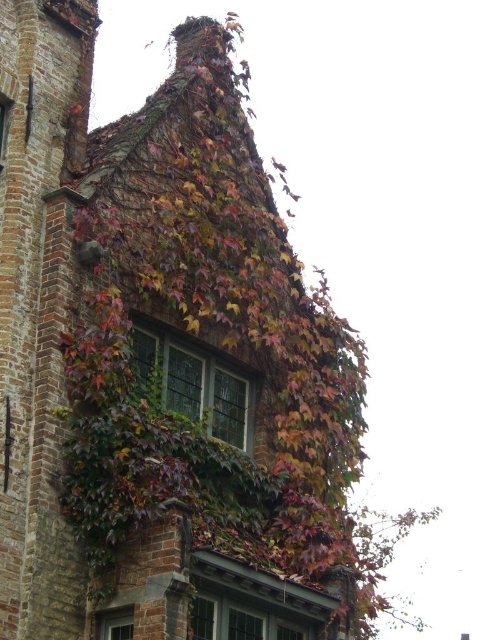
How distant is stained glass window at center from clear glass window at lower left?

stained glass window at center is 38.12 feet away from clear glass window at lower left.

Can you confirm if stained glass window at center is taller than clear glass window at lower left?

Correct, stained glass window at center is much taller as clear glass window at lower left.

You are a GUI agent. You are given a task and a screenshot of the screen. Output one action in this format:
    pyautogui.click(x=<x>, y=<y>)
    Task: Click on the stained glass window at center
    The width and height of the screenshot is (480, 640).
    Given the screenshot: What is the action you would take?
    pyautogui.click(x=194, y=381)

At what (x,y) coordinates should I click in order to perform the action: click on stained glass window at center. Please return your answer as a coordinate pair (x, y). This screenshot has height=640, width=480. Looking at the image, I should click on (194, 381).